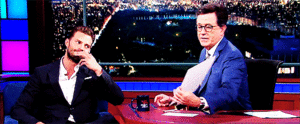
Where is `mug on the desk`? The height and width of the screenshot is (124, 300). mug on the desk is located at coordinates (140, 100).